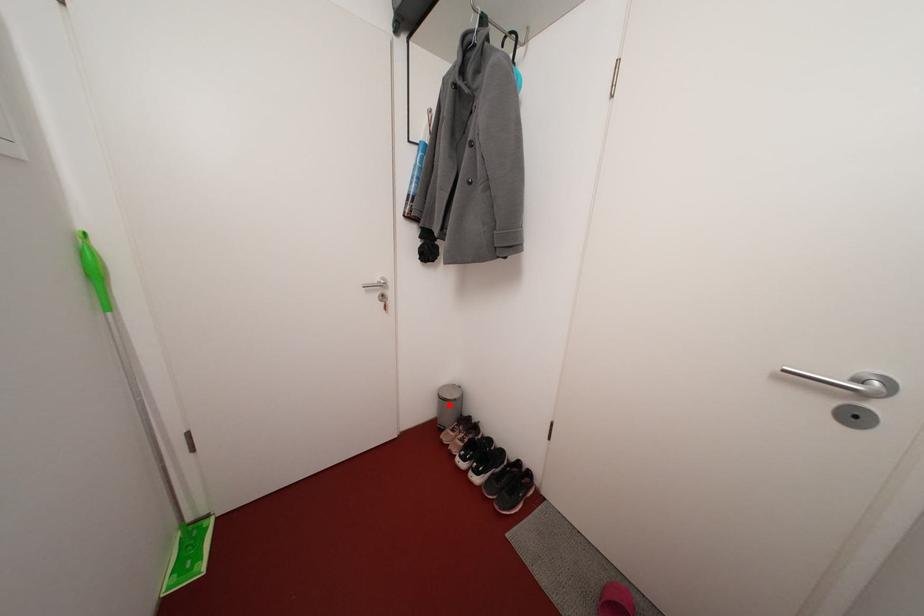
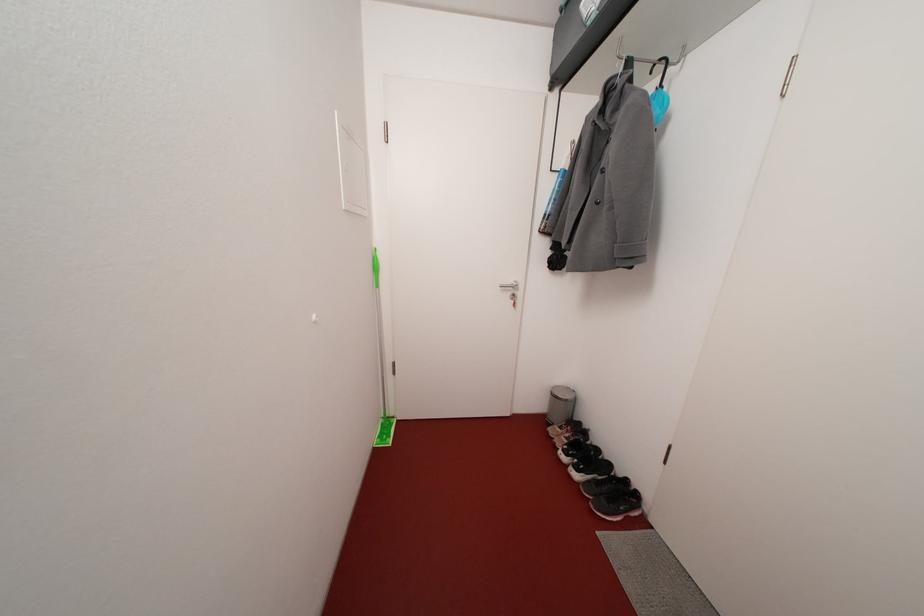
Question: I am providing you with two images of the same scene from different viewpoints. A red point is marked on the first image. At the location where the point appears in image 1, is it still visible in image 2?

Choices:
 (A) Yes
 (B) No

Answer: (A)